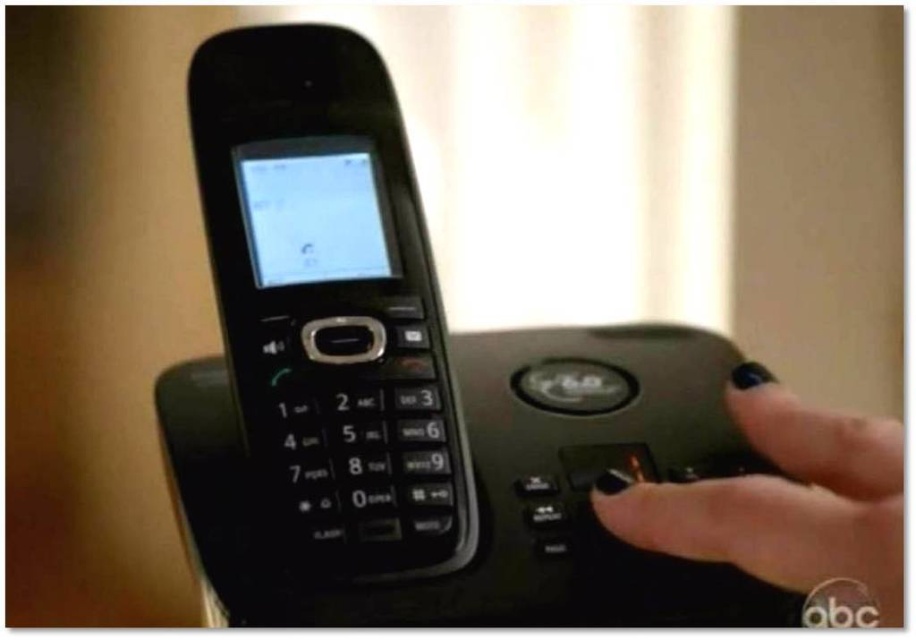
Does black plastic phone at center come in front of black polished nail at right?

No, black plastic phone at center is further to the viewer.

The width and height of the screenshot is (916, 640). In order to click on black plastic phone at center in this screenshot , I will do `click(329, 301)`.